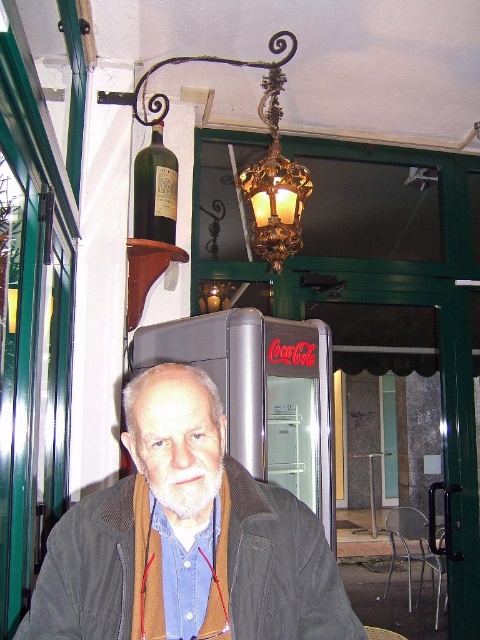
Question: Which of the following is the farthest from the observer?

Choices:
 (A) metallic silver table at center
 (B) brown corduroy jacket at center

Answer: (A)

Question: Is brown corduroy jacket at center above metallic silver table at center?

Choices:
 (A) no
 (B) yes

Answer: (B)

Question: Does brown corduroy jacket at center have a lesser width compared to green glass bottle at upper left?

Choices:
 (A) no
 (B) yes

Answer: (A)

Question: Which object is closer to the camera taking this photo?

Choices:
 (A) brown corduroy jacket at center
 (B) green glass bottle at upper left
 (C) metallic silver table at center

Answer: (A)

Question: Is brown corduroy jacket at center below green glass bottle at upper left?

Choices:
 (A) no
 (B) yes

Answer: (B)

Question: Which of the following is the farthest from the observer?

Choices:
 (A) (374, 456)
 (B) (201, 408)
 (C) (151, 205)

Answer: (A)